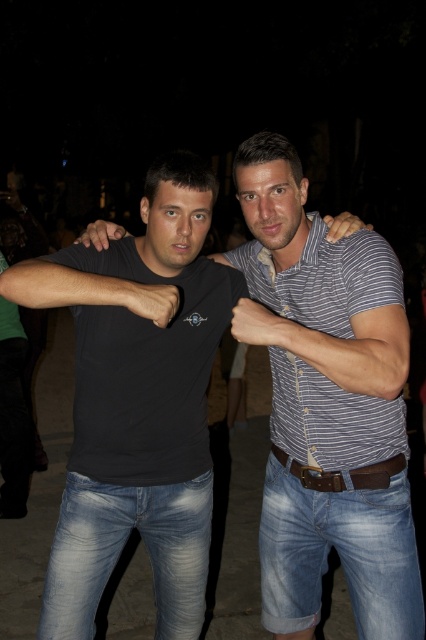
Question: Does matte black t-shirt at center appear on the right side of blue denim jeans at center?

Choices:
 (A) yes
 (B) no

Answer: (B)

Question: Which point is closer to the camera?

Choices:
 (A) black matte shirt at left
 (B) striped cotton shirt at center
 (C) matte black t-shirt at center

Answer: (A)

Question: Estimate the real-world distances between objects in this image. Which object is closer to the light blue denim jeans at lower center?

Choices:
 (A) blue denim jeans at center
 (B) brown leather belt at center

Answer: (A)

Question: Which point is farther to the camera?

Choices:
 (A) brown leather belt at center
 (B) matte black t-shirt at center
 (C) striped cotton shirt at center

Answer: (A)

Question: Is matte black t-shirt at center thinner than light blue denim jeans at lower center?

Choices:
 (A) yes
 (B) no

Answer: (B)

Question: In this image, where is matte black t-shirt at center located relative to blue denim jeans at center?

Choices:
 (A) right
 (B) left

Answer: (B)